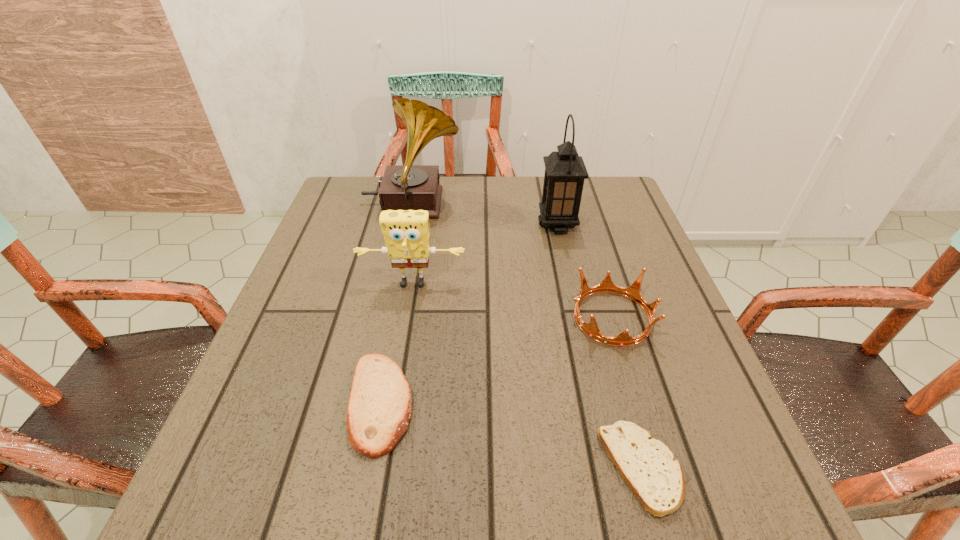
Locate an element on the screen. This screenshot has height=540, width=960. empty space between the right pita bread and the crown is located at coordinates (627, 393).

This screenshot has height=540, width=960. Find the location of `free point between the second shortest object and the fourth shortest object`. free point between the second shortest object and the fourth shortest object is located at coordinates (396, 344).

The height and width of the screenshot is (540, 960). I want to click on free space between the sponge and the third shortest object, so click(513, 301).

Locate an element on the screen. The height and width of the screenshot is (540, 960). free space between the shortest object and the phonograph record is located at coordinates (527, 336).

The image size is (960, 540). I want to click on vacant space that's between the lantern and the crown, so click(585, 271).

Find the location of `vacant point located between the taller pita bread and the lantern`. vacant point located between the taller pita bread and the lantern is located at coordinates (469, 314).

I want to click on free space between the sponge and the second shortest object, so click(x=396, y=344).

The height and width of the screenshot is (540, 960). Find the location of `empty location between the sponge and the left pita bread`. empty location between the sponge and the left pita bread is located at coordinates (396, 344).

At what (x,y) coordinates should I click in order to perform the action: click on vacant area that lies between the shorter pita bread and the sponge. Please return your answer as a coordinate pair (x, y). Looking at the image, I should click on (527, 376).

At what (x,y) coordinates should I click in order to perform the action: click on vacant area that lies between the crown and the phonograph record. Please return your answer as a coordinate pair (x, y). Image resolution: width=960 pixels, height=540 pixels. Looking at the image, I should click on (512, 261).